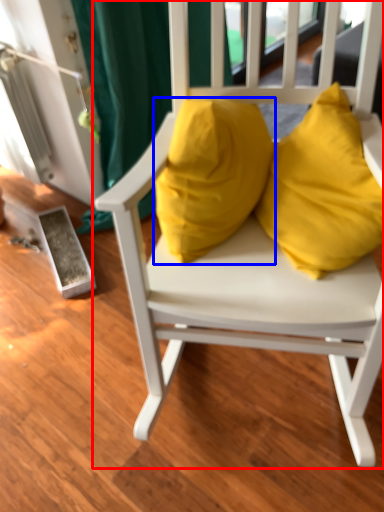
Question: Among these objects, which one is nearest to the camera, chair (highlighted by a red box) or pillow (highlighted by a blue box)?

Choices:
 (A) chair
 (B) pillow

Answer: (A)